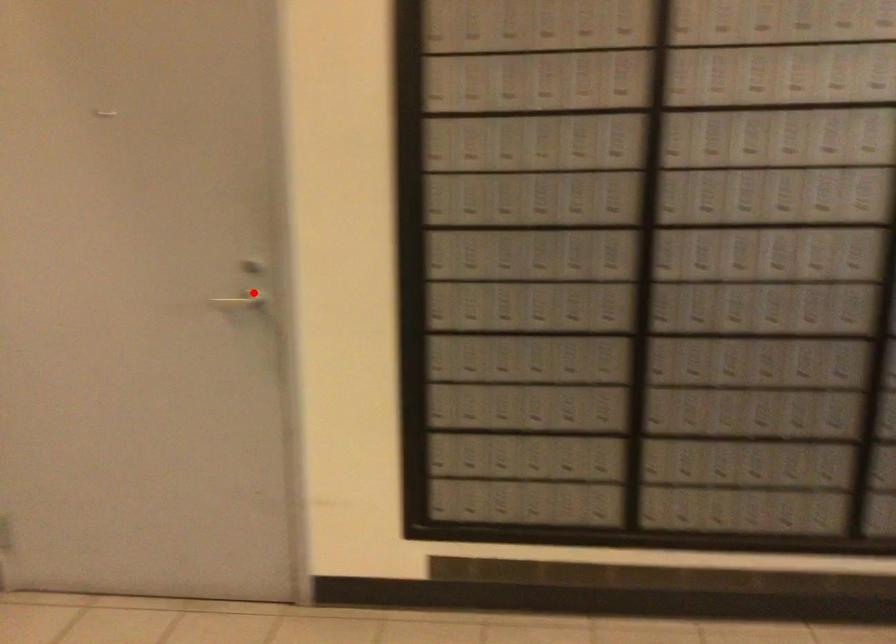
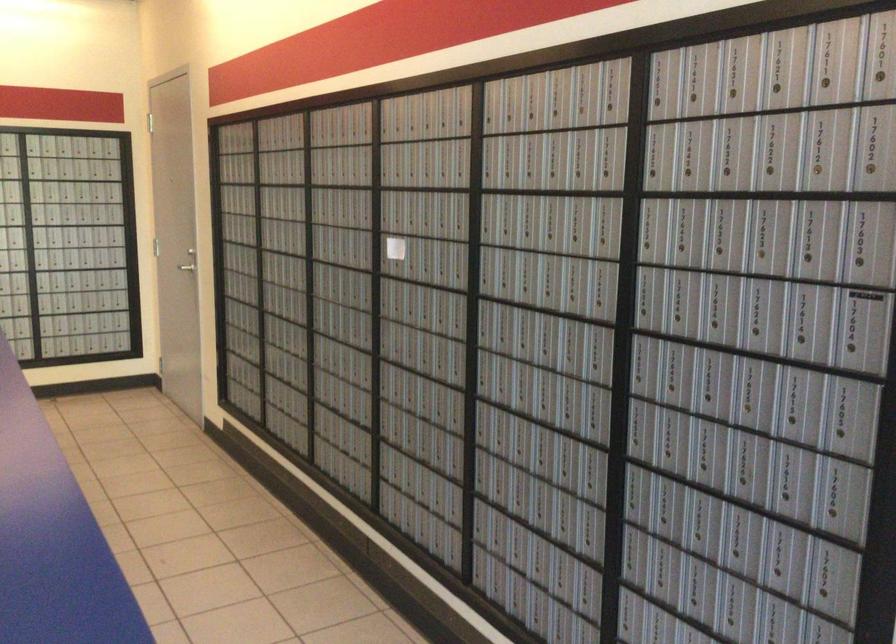
In the second image, find the point that corresponds to the highlighted location in the first image.

(188, 261)